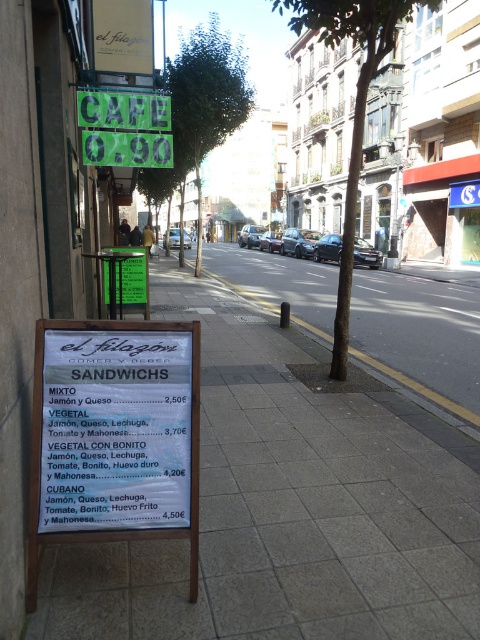
Question: Does white paper sandwich board at center have a smaller size compared to green leafy tree at upper center?

Choices:
 (A) yes
 (B) no

Answer: (A)

Question: Based on their relative distances, which object is nearer to the white paper sandwich board at center?

Choices:
 (A) green leafy tree at upper center
 (B) green plastic sign at upper center
 (C) white tile pavement at lower center

Answer: (C)

Question: Which point is closer to the camera taking this photo?

Choices:
 (A) (364, 88)
 (B) (91, 396)

Answer: (B)

Question: Which point is closer to the camera taking this photo?

Choices:
 (A) (337, 323)
 (B) (204, 392)
 (C) (192, 102)

Answer: (B)

Question: Does white paper sandwich board at center appear on the left side of green plastic sign at upper center?

Choices:
 (A) no
 (B) yes

Answer: (A)

Question: In this image, where is white tile pavement at lower center located relative to green plastic sign at upper center?

Choices:
 (A) left
 (B) right

Answer: (B)